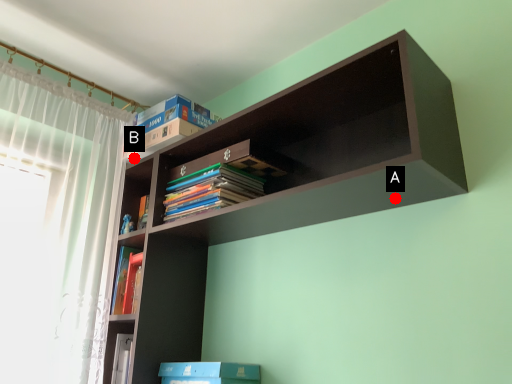
Question: Two points are circled on the image, labeled by A and B beside each circle. Which point is closer to the camera taking this photo?

Choices:
 (A) A is closer
 (B) B is closer

Answer: (A)